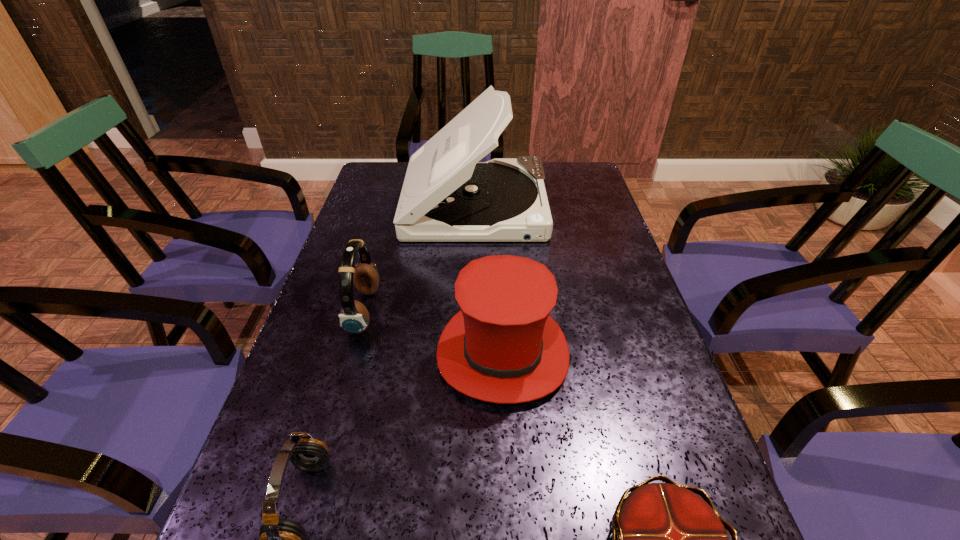
Where is `CD player`? CD player is located at coordinates (448, 195).

The image size is (960, 540). What are the coordinates of `the tallest object` in the screenshot? It's located at (448, 195).

Where is `hat`? The width and height of the screenshot is (960, 540). hat is located at coordinates pos(503,347).

Where is `the taller headset`? This screenshot has width=960, height=540. the taller headset is located at coordinates coord(354,317).

Locate an element on the screen. free space located 0.060m on the control panel of the farthest object is located at coordinates (565, 204).

Find the location of a particular element. This screenshot has width=960, height=540. vacant space located on the front of the hat is located at coordinates (511, 515).

The height and width of the screenshot is (540, 960). What are the coordinates of `free spot located 0.350m on the ear cup of the farther headset` in the screenshot? It's located at (526, 311).

Find the location of a particular element. The width and height of the screenshot is (960, 540). object present at the far edge is located at coordinates (448, 195).

In order to click on CD player that is at the left edge in this screenshot , I will do `click(448, 195)`.

What are the coordinates of `headset that is at the left edge` in the screenshot? It's located at (354, 317).